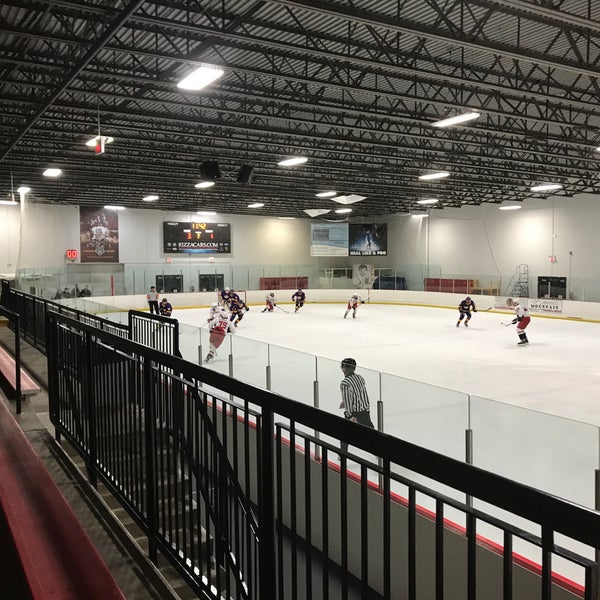
Find the location of a particular element. ceiling is located at coordinates 304,17.